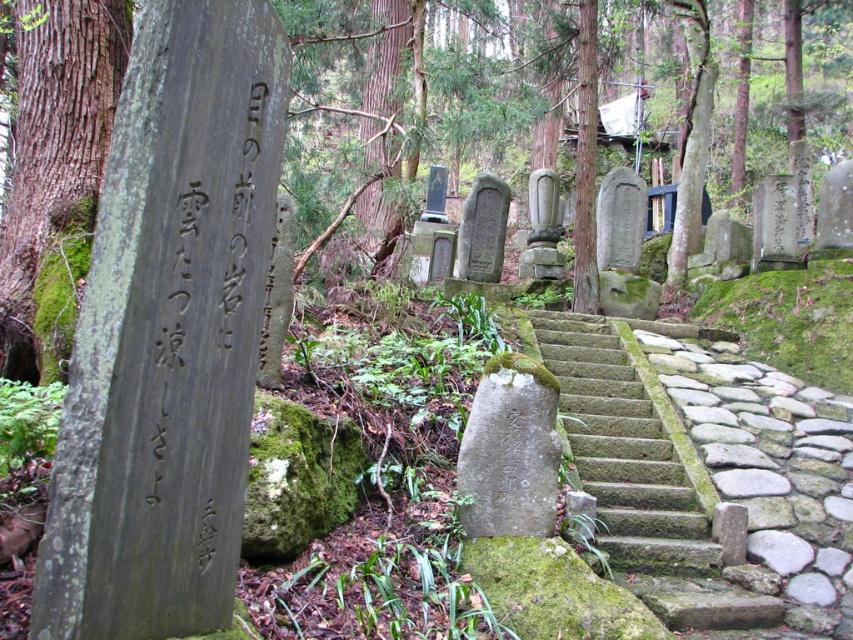
Measure the distance between point (296, 163) and camera.

The distance of point (296, 163) from camera is 31.60 feet.

Does green mossy stone at left have a lesser height compared to green mossy stone stairs at center?

No, green mossy stone at left is not shorter than green mossy stone stairs at center.

The image size is (853, 640). In order to click on green mossy stone at left in this screenshot , I will do `click(55, 124)`.

Based on the photo, does green mossy stone at left appear on the left side of gray stone gravestone at center?

Incorrect, green mossy stone at left is not on the left side of gray stone gravestone at center.

Does green mossy stone at left appear under gray stone gravestone at center?

Actually, green mossy stone at left is above gray stone gravestone at center.

This screenshot has height=640, width=853. Find the location of `green mossy stone at left`. green mossy stone at left is located at coordinates (55, 124).

You are a GUI agent. You are given a task and a screenshot of the screen. Output one action in this format:
    pyautogui.click(x=<x>, y=<y>)
    Task: Click on the green mossy stone at left
    The width and height of the screenshot is (853, 640).
    Given the screenshot: What is the action you would take?
    pyautogui.click(x=55, y=124)

Is green mossy stone stairs at center to the right of gray stone gravestone at center from the viewer's perspective?

Correct, you'll find green mossy stone stairs at center to the right of gray stone gravestone at center.

Can you confirm if green mossy stone stairs at center is shorter than gray stone gravestone at center?

No, green mossy stone stairs at center is not shorter than gray stone gravestone at center.

Measure the distance between point (625, 476) and camera.

Point (625, 476) is 6.28 meters away from camera.

At what (x,y) coordinates should I click in order to perform the action: click on green mossy stone stairs at center. Please return your answer as a coordinate pair (x, y). The height and width of the screenshot is (640, 853). Looking at the image, I should click on (624, 452).